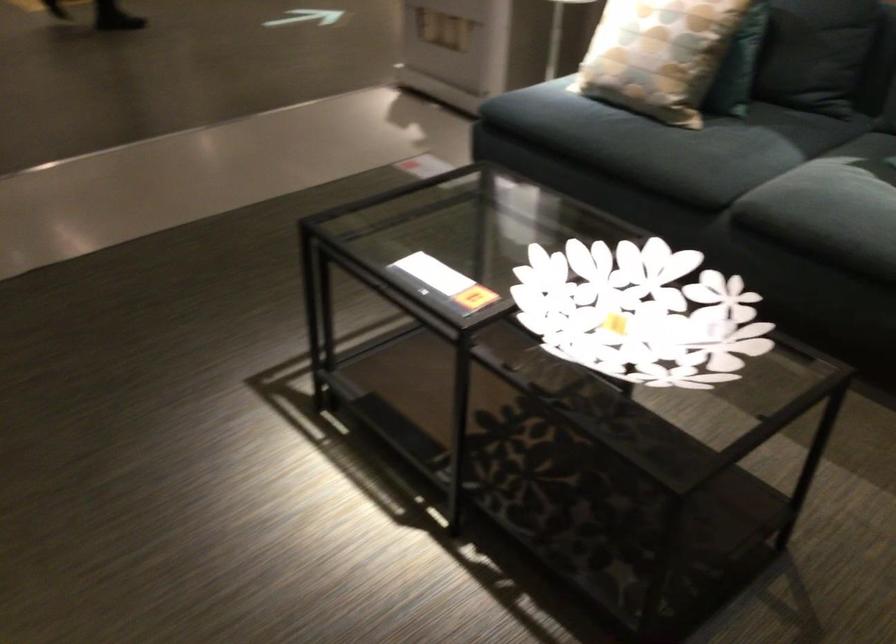
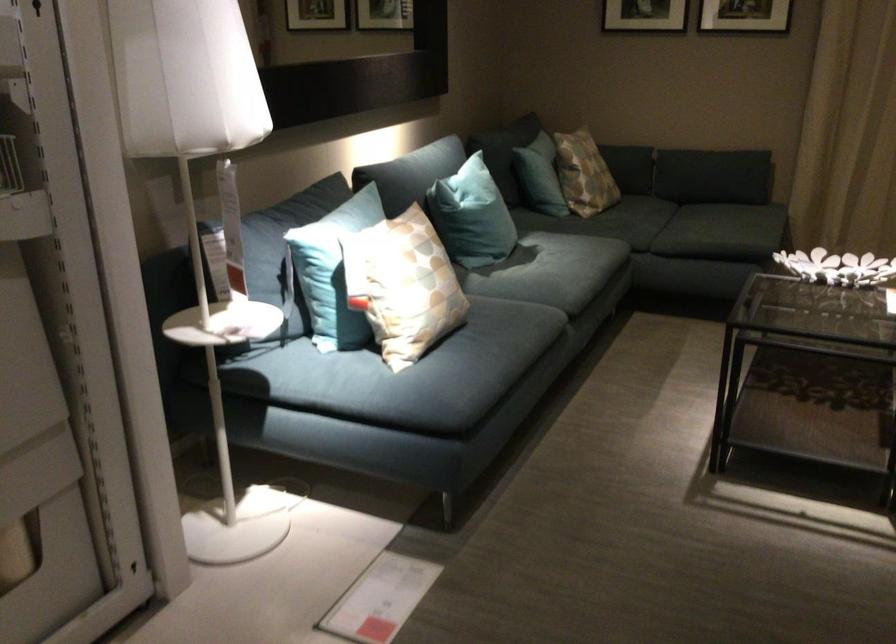
The point at (622, 342) is marked in the first image. Where is the corresponding point in the second image?

(837, 267)